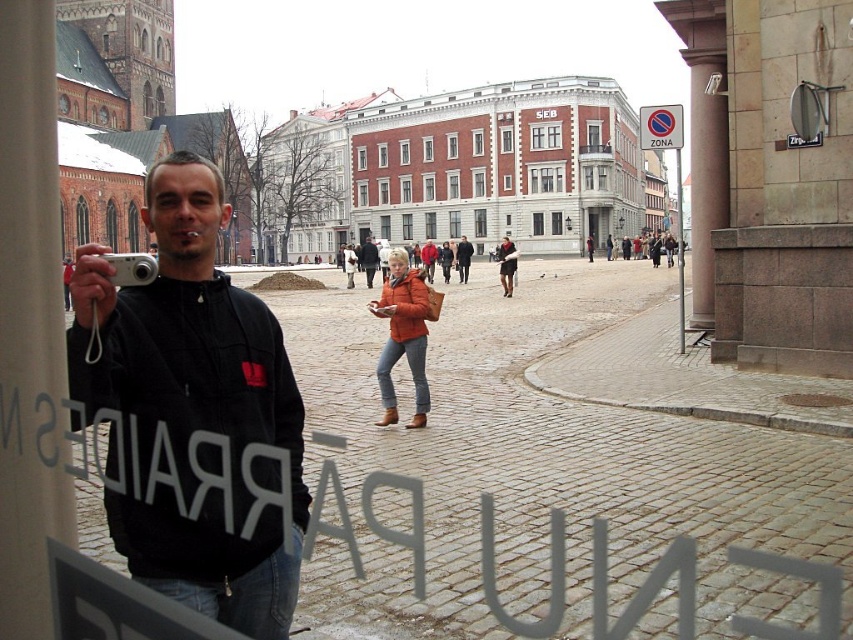
You are a photographer standing in front of the glass window with the text P?RR?IDES. You see a red plastic sign at upper center and a brown leather jacket at center. Which object is taller?

The red plastic sign at upper center is taller than the brown leather jacket at center according to the description.

You are a photographer standing in the foreground holding a camera. You notice a red plastic sign at upper center and an orange leather jacket at center. Which object is wider?

The red plastic sign at upper center is wider than the orange leather jacket at center.